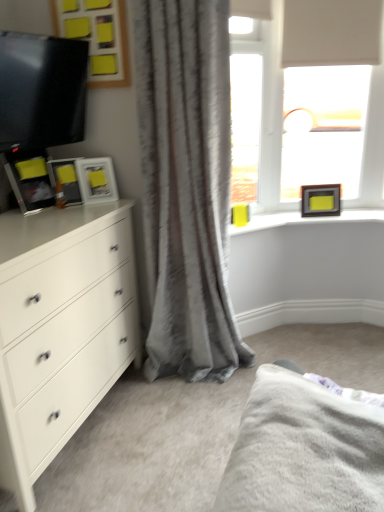
Question: From the image's perspective, is matte black picture frame at left, which is counted as the second picture frame, starting from the left, located above or below fuzzy gray bed at lower right?

Choices:
 (A) above
 (B) below

Answer: (A)

Question: From a real-world perspective, relative to fuzzy gray bed at lower right, is matte black picture frame at left, which is the 2th picture frame from right to left, vertically above or below?

Choices:
 (A) above
 (B) below

Answer: (A)

Question: Estimate the real-world distances between objects in this image. Which object is closer to the fuzzy gray bed at lower right?

Choices:
 (A) white matte chest of drawers at left
 (B) white matte window at upper right
 (C) matte black picture frame at left, the 3th picture frame in the back-to-front sequence
 (D) matte black picture frame at left, which ranks as the second picture frame in front-to-back order
 (E) gray textured curtain at center

Answer: (A)

Question: Which is nearer to the matte black picture frame at left, which appears as the 2th picture frame when viewed from the back?

Choices:
 (A) gray textured curtain at center
 (B) matte black picture frame at left, acting as the third picture frame starting from the right
 (C) fuzzy gray bed at lower right
 (D) white matte chest of drawers at left
 (E) matte black picture frame at upper right, placed as the first picture frame when sorted from back to front

Answer: (B)